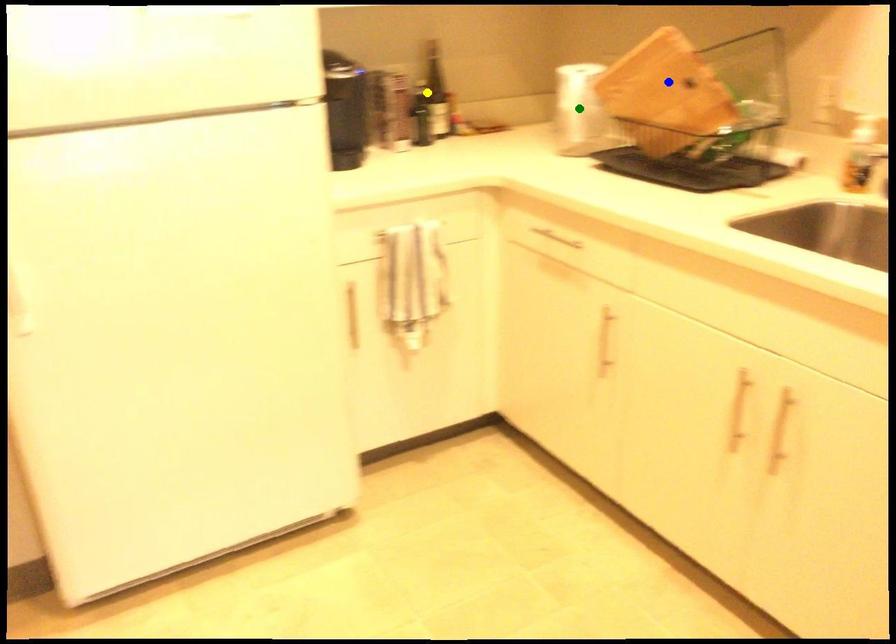
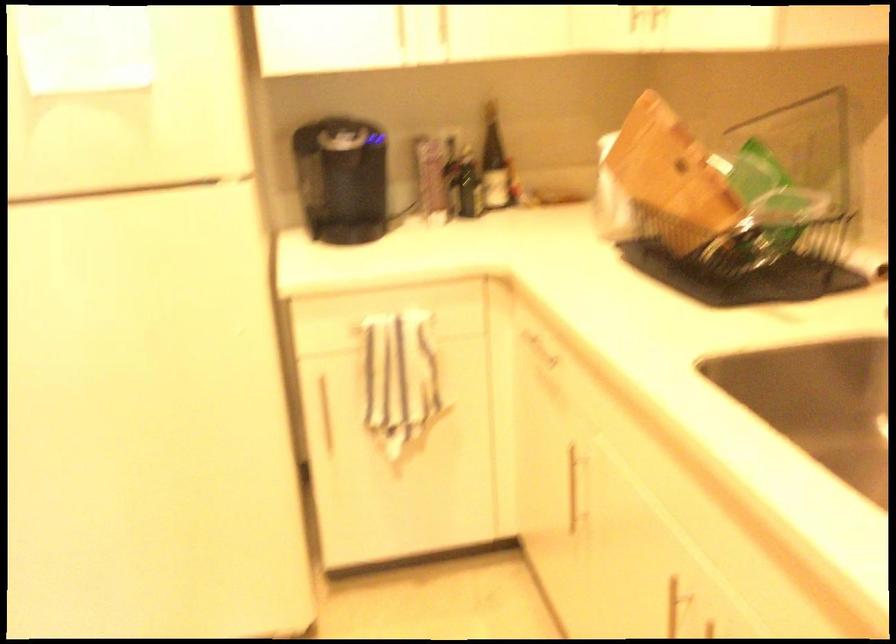
I am providing you with two images of the same scene from different viewpoints. Three points are marked in image1. Which point corresponds to a part or object that is occluded in image2?In image1, three points are marked. Which of them correspond to a part or object that is occluded in image2?Among the three points shown in image1, which one corresponds to a part or object that is no longer visible due to occlusion in image2?

green point